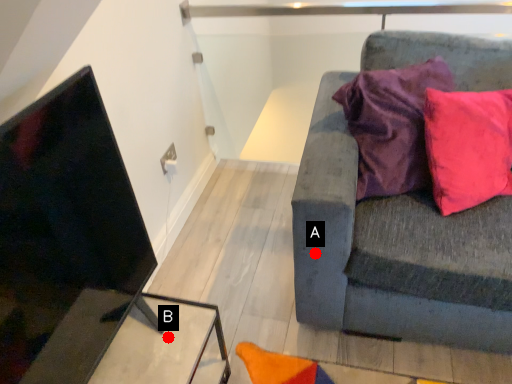
Question: Two points are circled on the image, labeled by A and B beside each circle. Which of the following is the farthest from the observer?

Choices:
 (A) A is further
 (B) B is further

Answer: (A)